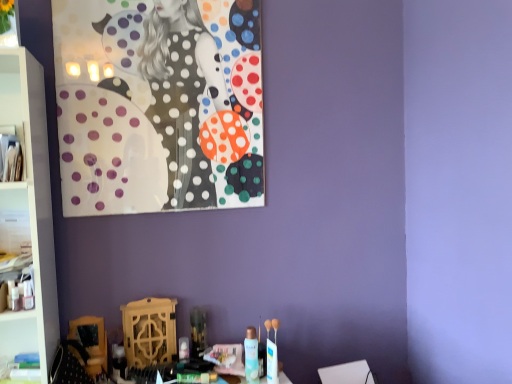
Question: From their relative heights in the image, would you say white glossy cabinet at left, which is counted as the first cabinet, starting from the back, is taller or shorter than translucent plastic spray can at center?

Choices:
 (A) tall
 (B) short

Answer: (A)

Question: In terms of width, does white glossy cabinet at left, which ranks as the 2th cabinet in front-to-back order, look wider or thinner when compared to translucent plastic spray can at center?

Choices:
 (A) thin
 (B) wide

Answer: (A)

Question: Which is farther from the polished glass painting at upper left?

Choices:
 (A) translucent plastic bottle at lower center
 (B) translucent plastic spray can at center
 (C) white glossy cabinet at left, the first cabinet in the bottom-to-top sequence
 (D) white plastic cabinet at left, which is counted as the 1th cabinet, starting from the front

Answer: (A)

Question: Estimate the real-world distances between objects in this image. Which object is farther from the translucent plastic spray can at center?

Choices:
 (A) translucent plastic bottle at lower center
 (B) white glossy cabinet at left, which is counted as the first cabinet, starting from the back
 (C) polished glass painting at upper left
 (D) white plastic cabinet at left, which ranks as the 2th cabinet in back-to-front order

Answer: (D)